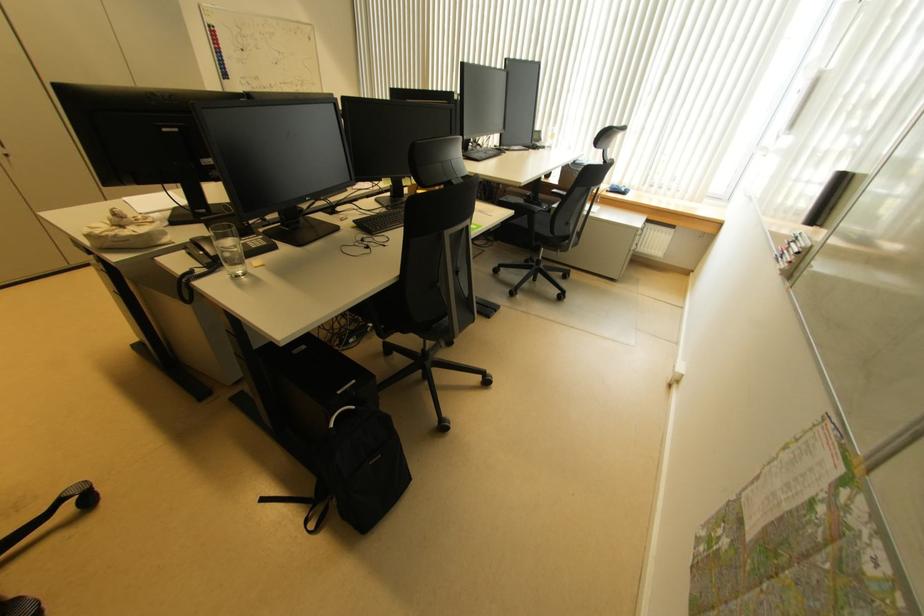
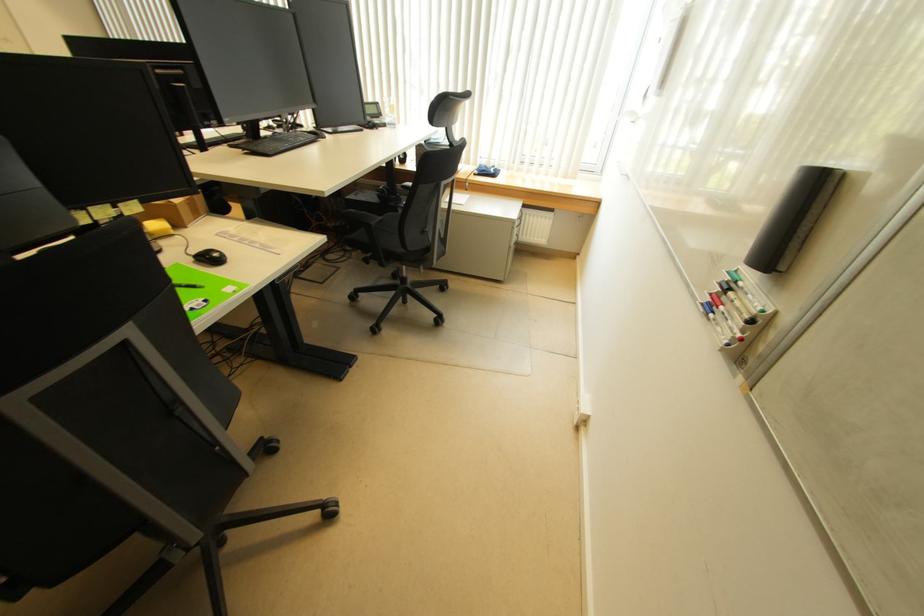
Find the pixel in the second image that matches (795,246) in the first image.

(733, 296)